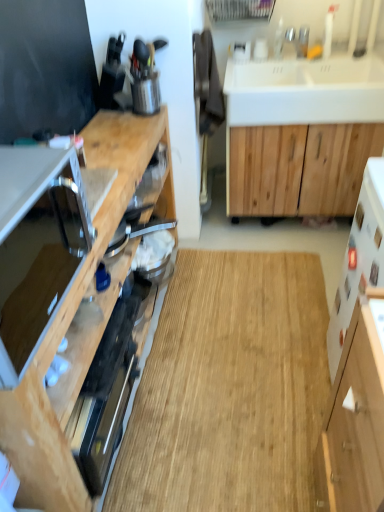
Question: Is white glossy sink at upper right taller or shorter than satin silver microwave at left, which ranks as the second appliance in top-to-bottom order?

Choices:
 (A) tall
 (B) short

Answer: (B)

Question: Is point (382, 74) positioned closer to the camera than point (26, 199)?

Choices:
 (A) farther
 (B) closer

Answer: (A)

Question: Which is farther from the white glossy sink at upper right?

Choices:
 (A) natural wood floor at center
 (B) silver metallic faucet at upper right
 (C) wooden cabinet at left, acting as the 3th cabinetry starting from the right
 (D) satin silver microwave at left, marked as the first appliance in a bottom-to-top arrangement
 (E) metallic silver utensil holder at upper left, which is counted as the second appliance, starting from the bottom

Answer: (D)

Question: Considering the real-world distances, which object is closest to the natural wood floor at center?

Choices:
 (A) white glossy sink at upper right
 (B) natural wood cabinet at center, the 3th cabinetry from the left
 (C) wooden cabinet at left, the 1th cabinetry viewed from the left
 (D) white matte cabinet at lower right, the 2th cabinetry from the left
 (E) metallic silver utensil holder at upper left, positioned as the second appliance in front-to-back order

Answer: (D)